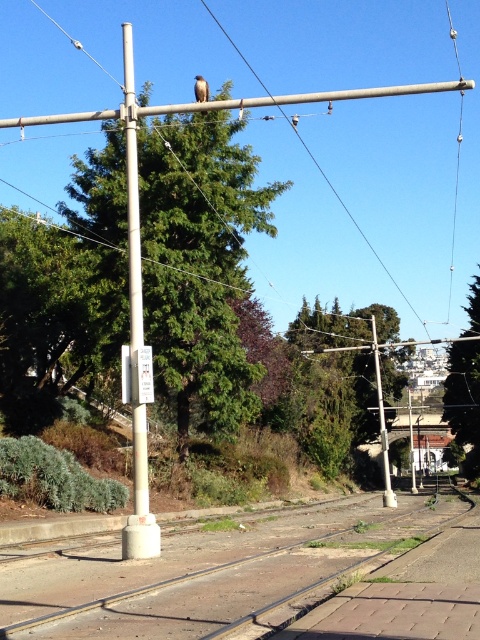
Does point (167, 568) lie in front of point (143, 554)?

That is True.

Find the location of a particular element. This screenshot has width=480, height=640. smooth concrete train track at center is located at coordinates (206, 572).

Which is behind, point (176, 116) or point (141, 550)?

Positioned behind is point (176, 116).

Who is lower down, green textured tree at upper center or smooth metallic pole at center?

Positioned lower is green textured tree at upper center.

I want to click on green textured tree at upper center, so click(x=200, y=266).

Can you confirm if smooth concrete train track at center is positioned to the left of brown feathered eagle at upper center?

In fact, smooth concrete train track at center is to the right of brown feathered eagle at upper center.

Does smooth concrete train track at center have a smaller size compared to brown feathered eagle at upper center?

Yes.

Locate an element on the screen. The height and width of the screenshot is (640, 480). smooth concrete train track at center is located at coordinates (206, 572).